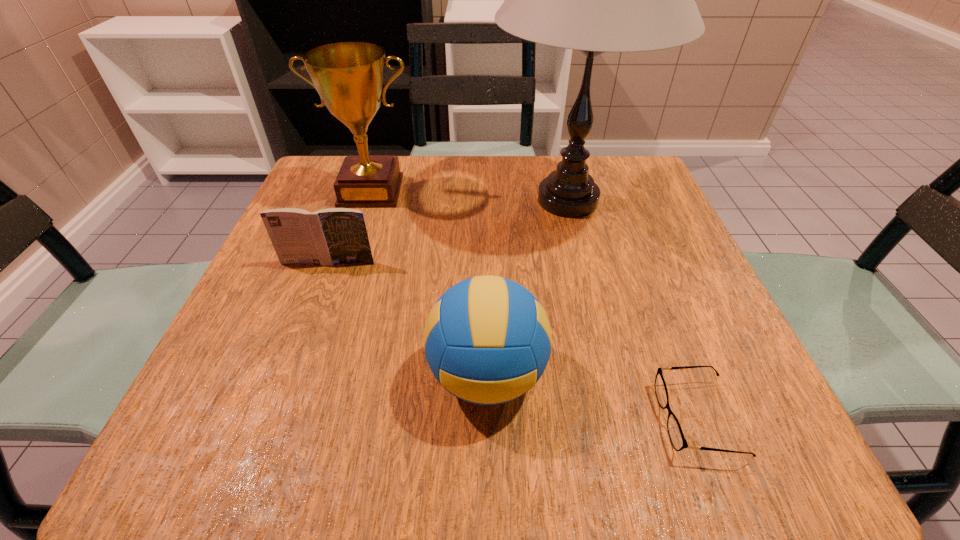
You are a GUI agent. You are given a task and a screenshot of the screen. Output one action in this format:
    pyautogui.click(x=<x>, y=<y>)
    Task: Click on the spectacles that is at the right edge
    The image size is (960, 540).
    Given the screenshot: What is the action you would take?
    pyautogui.click(x=678, y=441)

Identify the location of object situated at the far left corner. click(349, 77).

You are a GUI agent. You are given a task and a screenshot of the screen. Output one action in this format:
    pyautogui.click(x=<x>, y=<y>)
    Task: Click on the object that is at the far right corner
    This screenshot has height=540, width=960.
    Given the screenshot: What is the action you would take?
    pyautogui.click(x=595, y=0)

You are a GUI agent. You are given a task and a screenshot of the screen. Output one action in this format:
    pyautogui.click(x=<x>, y=<y>)
    Task: Click on the object present at the near right corner
    Image resolution: width=960 pixels, height=540 pixels.
    Given the screenshot: What is the action you would take?
    pyautogui.click(x=678, y=441)

At what (x,y) coordinates should I click in order to perform the action: click on vacant space at the far edge of the desktop. Please return your answer as a coordinate pair (x, y). This screenshot has height=540, width=960. Looking at the image, I should click on (418, 166).

Locate an element on the screen. vacant space at the near edge of the desktop is located at coordinates (331, 465).

This screenshot has width=960, height=540. In order to click on vacant space at the left edge of the desktop in this screenshot , I will do `click(259, 366)`.

At what (x,y) coordinates should I click in order to perform the action: click on vacant area at the right edge of the desktop. Please return your answer as a coordinate pair (x, y). The width and height of the screenshot is (960, 540). Looking at the image, I should click on (651, 221).

Identify the location of free spot at the far left corner of the desktop. (324, 208).

At what (x,y) coordinates should I click in order to perform the action: click on free point at the near right corner. Please return your answer as a coordinate pair (x, y). The width and height of the screenshot is (960, 540). Looking at the image, I should click on (780, 437).